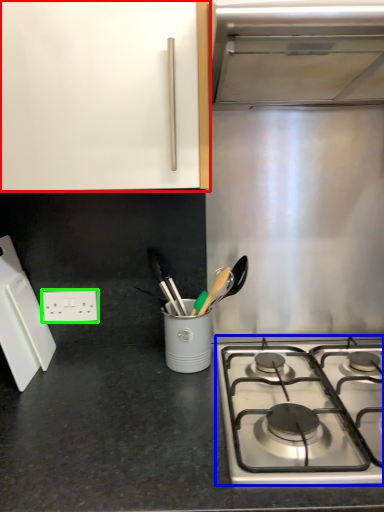
Question: Based on their relative distances, which object is nearer to cabinetry (highlighted by a red box)? Choose from gas stove (highlighted by a blue box) and electric outlet (highlighted by a green box).

Choices:
 (A) gas stove
 (B) electric outlet

Answer: (B)